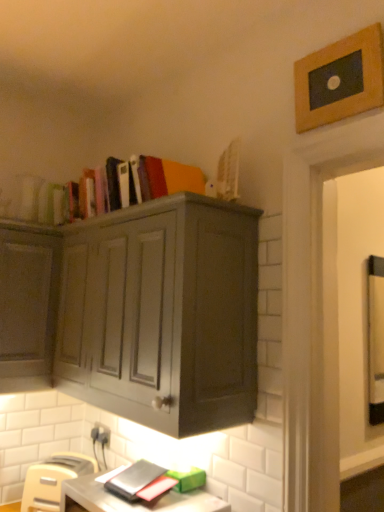
At what (x,y) coordinates should I click in order to perform the action: click on white plastic electric outlet at lower left. Please return your answer as a coordinate pair (x, y). Looking at the image, I should click on (100, 434).

In order to click on wooden picture frame at upper right in this screenshot , I will do (x=340, y=80).

You are a GUI agent. You are given a task and a screenshot of the screen. Output one action in this format:
    pyautogui.click(x=<x>, y=<y>)
    Task: Click on the matte gray cabinet at upper center
    
    Given the screenshot: What is the action you would take?
    pyautogui.click(x=149, y=313)

In order to face matte gray cabinet at upper center, should I rotate leftwards or rightwards?

Turn left approximately 9.256 degrees to face it.

Locate an element on the screen. matte gray desk at lower center is located at coordinates (132, 502).

Based on their sizes in the image, would you say matte gray desk at lower center is bigger or smaller than matte gray cabinet at upper center?

Considering their sizes, matte gray desk at lower center takes up less space than matte gray cabinet at upper center.

Does point (138, 508) lie in front of point (230, 302)?

Yes, point (138, 508) is in front of point (230, 302).

Can you tell me how much matte gray desk at lower center and matte gray cabinet at upper center differ in facing direction?

The angular difference between matte gray desk at lower center and matte gray cabinet at upper center is 1.85 degrees.

Is matte gray desk at lower center oriented towards white plastic electric outlet at lower left?

No, matte gray desk at lower center is not oriented towards white plastic electric outlet at lower left.

From the image's perspective, is matte gray desk at lower center above or below white plastic electric outlet at lower left?

Based on their image positions, matte gray desk at lower center is located beneath white plastic electric outlet at lower left.

Does matte gray desk at lower center have a larger size compared to white plastic electric outlet at lower left?

Correct, matte gray desk at lower center is larger in size than white plastic electric outlet at lower left.

Is the position of matte gray desk at lower center more distant than that of white plastic electric outlet at lower left?

No, it is in front of white plastic electric outlet at lower left.

What's the angular difference between matte gray desk at lower center and matte hardcover books at upper center's facing directions?

There is a 0.295-degree angle between the facing directions of matte gray desk at lower center and matte hardcover books at upper center.

From a real-world perspective, does matte gray desk at lower center sit lower than matte hardcover books at upper center?

Yes.

In the scene shown: Are matte gray desk at lower center and matte hardcover books at upper center beside each other?

matte gray desk at lower center and matte hardcover books at upper center are clearly separated.

Relative to matte hardcover books at upper center, is matte gray desk at lower center in front or behind?

In the image, matte gray desk at lower center appears in front of matte hardcover books at upper center.

Which is more to the right, beige plastic toaster at lower left or white plastic electric outlet at lower left?

From the viewer's perspective, white plastic electric outlet at lower left appears more on the right side.

At what (x,y) coordinates should I click in order to perform the action: click on electric outlet that appears above the beige plastic toaster at lower left (from the image's perspective). Please return your answer as a coordinate pair (x, y). This screenshot has width=384, height=512. Looking at the image, I should click on (100, 434).

From the image's perspective, which one is positioned lower, beige plastic toaster at lower left or white plastic electric outlet at lower left?

beige plastic toaster at lower left is shown below in the image.

Between white plastic electric outlet at lower left and matte hardcover books at upper center, which one appears on the right side from the viewer's perspective?

matte hardcover books at upper center.

Looking at this image, from a real-world perspective, is white plastic electric outlet at lower left under matte hardcover books at upper center?

Correct, in the physical world, white plastic electric outlet at lower left is lower than matte hardcover books at upper center.

From the image's perspective, is white plastic electric outlet at lower left over matte hardcover books at upper center?

No, from the image's perspective, white plastic electric outlet at lower left is not above matte hardcover books at upper center.

Between wooden picture frame at upper right and matte gray desk at lower center, which one appears on the left side from the viewer's perspective?

From the viewer's perspective, matte gray desk at lower center appears more on the left side.

Is matte gray desk at lower center at the back of wooden picture frame at upper right?

wooden picture frame at upper right does not have its back to matte gray desk at lower center.

Does wooden picture frame at upper right touch matte gray desk at lower center?

No, wooden picture frame at upper right is not beside matte gray desk at lower center.

Considering the relative sizes of wooden picture frame at upper right and matte gray desk at lower center in the image provided, is wooden picture frame at upper right taller than matte gray desk at lower center?

Yes.

From a real-world perspective, does white plastic electric outlet at lower left sit lower than beige plastic toaster at lower left?

No.

Can you tell me how much white plastic electric outlet at lower left and beige plastic toaster at lower left differ in facing direction?

The facing directions of white plastic electric outlet at lower left and beige plastic toaster at lower left are 33.5 degrees apart.

From the image's perspective, is white plastic electric outlet at lower left positioned above or below beige plastic toaster at lower left?

white plastic electric outlet at lower left is above beige plastic toaster at lower left.

Locate an element on the screen. This screenshot has height=512, width=384. electric outlet on the right of the beige plastic toaster at lower left is located at coordinates (100, 434).

Locate an element on the screen. The height and width of the screenshot is (512, 384). cabinetry behind the matte gray desk at lower center is located at coordinates (149, 313).

I want to click on computer desk below the white plastic electric outlet at lower left (from the image's perspective), so click(132, 502).

When comparing their distances from wooden picture frame at upper right, does matte gray cabinet at upper center or matte hardcover books at upper center seem further?

Based on the image, matte gray cabinet at upper center appears to be further to wooden picture frame at upper right.

Considering their positions, is matte gray cabinet at upper center positioned closer to beige plastic toaster at lower left than white plastic electric outlet at lower left?

Based on the image, white plastic electric outlet at lower left appears to be nearer to beige plastic toaster at lower left.

Estimate the real-world distances between objects in this image. Which object is closer to white plastic electric outlet at lower left, matte gray desk at lower center or beige plastic toaster at lower left?

Based on the image, beige plastic toaster at lower left appears to be nearer to white plastic electric outlet at lower left.

Based on their spatial positions, is matte gray desk at lower center or beige plastic toaster at lower left further from matte gray cabinet at upper center?

beige plastic toaster at lower left is positioned further to the anchor matte gray cabinet at upper center.

When comparing their distances from matte hardcover books at upper center, does matte gray cabinet at upper center or wooden picture frame at upper right seem further?

Based on the image, wooden picture frame at upper right appears to be further to matte hardcover books at upper center.

Looking at the image, which one is located closer to matte gray desk at lower center, matte gray cabinet at upper center or wooden picture frame at upper right?

matte gray cabinet at upper center lies closer to matte gray desk at lower center than the other object.

Considering their positions, is matte hardcover books at upper center positioned further to wooden picture frame at upper right than matte gray desk at lower center?

matte gray desk at lower center.

Looking at the image, which one is located further to matte gray cabinet at upper center, matte hardcover books at upper center or white plastic electric outlet at lower left?

white plastic electric outlet at lower left.

Find the location of `cabinetry that lies between matte hardcover books at upper center and white plastic electric outlet at lower left from top to bottom`. cabinetry that lies between matte hardcover books at upper center and white plastic electric outlet at lower left from top to bottom is located at coordinates (149, 313).

You are a GUI agent. You are given a task and a screenshot of the screen. Output one action in this format:
    pyautogui.click(x=<x>, y=<y>)
    Task: Click on the electric outlet that lies between wooden picture frame at upper right and beige plastic toaster at lower left from top to bottom
    The image size is (384, 512).
    Given the screenshot: What is the action you would take?
    pyautogui.click(x=100, y=434)

The height and width of the screenshot is (512, 384). In order to click on computer desk between wooden picture frame at upper right and beige plastic toaster at lower left vertically in this screenshot , I will do `click(132, 502)`.

Where is `chair positioned between matte gray desk at lower center and white plastic electric outlet at lower left from near to far`? The height and width of the screenshot is (512, 384). chair positioned between matte gray desk at lower center and white plastic electric outlet at lower left from near to far is located at coordinates (53, 480).